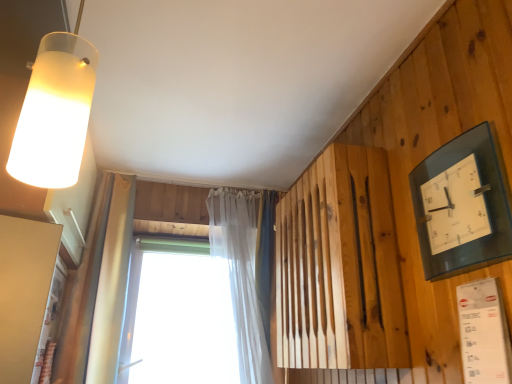
Question: Considering the positions of transparent plastic window at center and translucent fabric curtain at upper center in the image, is transparent plastic window at center taller or shorter than translucent fabric curtain at upper center?

Choices:
 (A) short
 (B) tall

Answer: (A)

Question: Considering the positions of transparent plastic window at center and translucent fabric curtain at upper center in the image, is transparent plastic window at center bigger or smaller than translucent fabric curtain at upper center?

Choices:
 (A) small
 (B) big

Answer: (A)

Question: Estimate the real-world distances between objects in this image. Which object is farther from the frosted glass lampshade at upper left?

Choices:
 (A) transparent plastic window at center
 (B) transparent glass clock at upper right
 (C) translucent fabric curtain at upper center

Answer: (A)

Question: Estimate the real-world distances between objects in this image. Which object is closer to the translucent fabric curtain at upper center?

Choices:
 (A) frosted glass lampshade at upper left
 (B) transparent plastic window at center
 (C) transparent glass clock at upper right

Answer: (B)